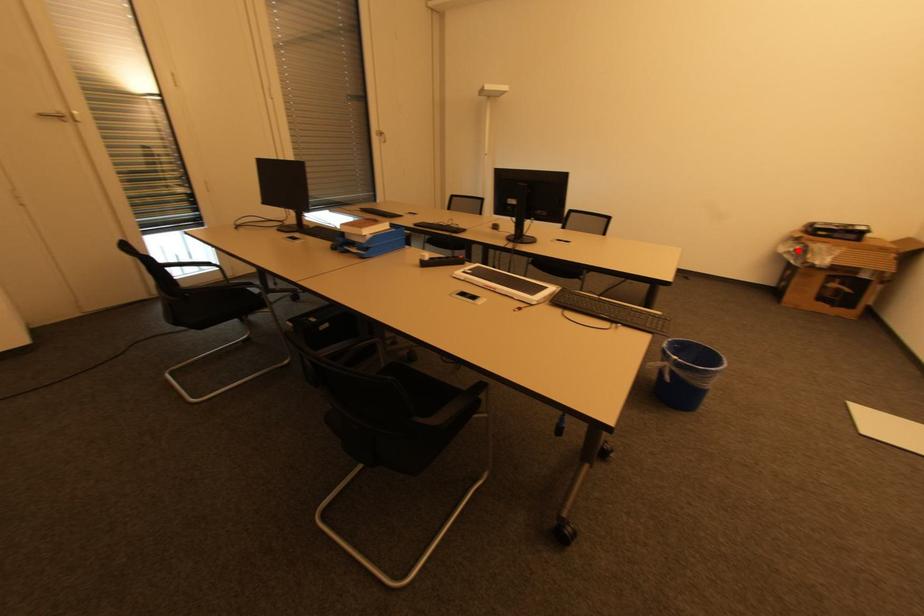
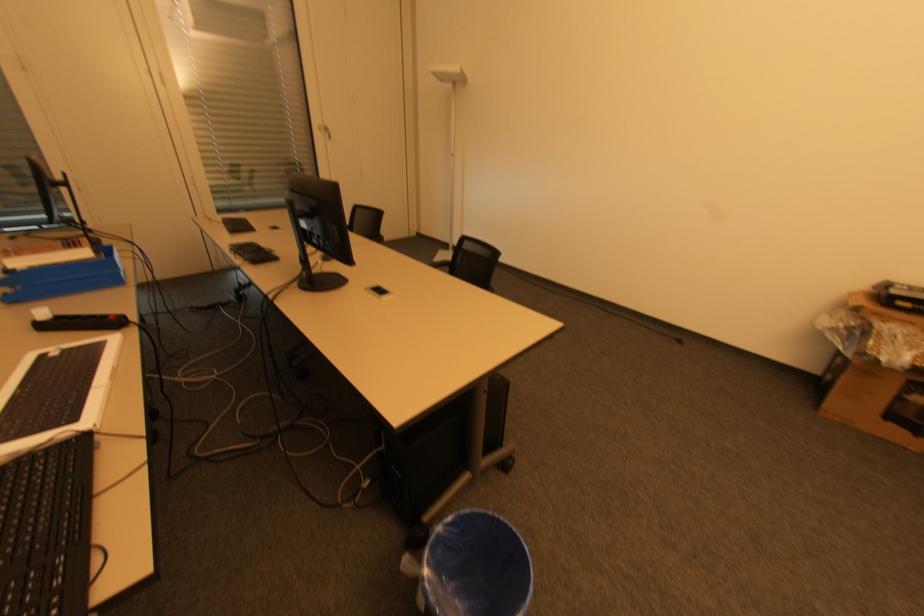
Where in the second image is the point corresponding to the highlighted location from the first image?

(850, 328)